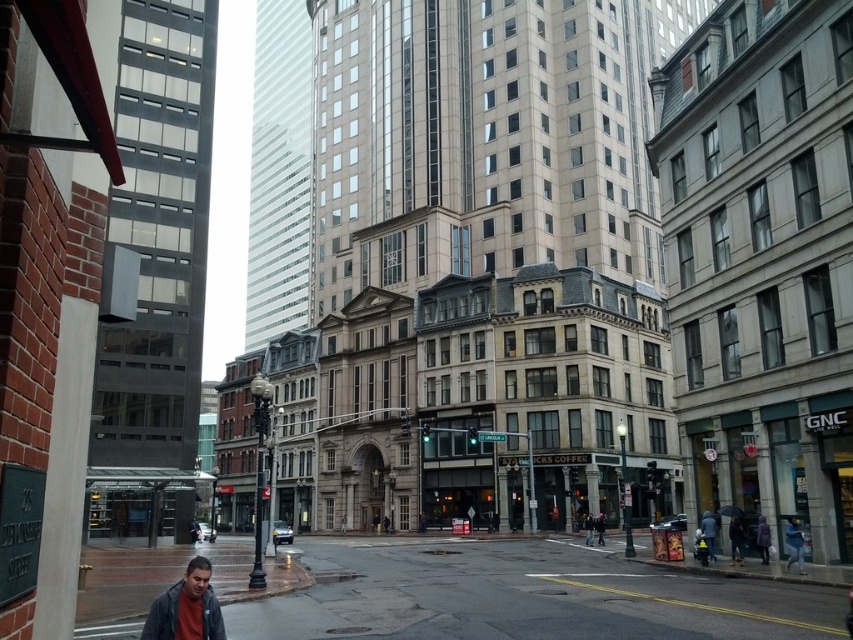
Question: Among these objects, which one is farthest from the camera?

Choices:
 (A) dark gray jacket at lower left
 (B) dark gray asphalt at lower center
 (C) dark blue jacket at lower right

Answer: (C)

Question: Is dark blue jacket at lower right to the right of purple matte coat at lower right from the viewer's perspective?

Choices:
 (A) no
 (B) yes

Answer: (A)

Question: Among these points, which one is nearest to the camera?

Choices:
 (A) (215, 596)
 (B) (305, 593)

Answer: (A)

Question: Is dark gray jacket at lower left closer to the viewer compared to purple matte coat at lower right?

Choices:
 (A) yes
 (B) no

Answer: (A)

Question: From the image, what is the correct spatial relationship of dark gray asphalt at lower center in relation to purple matte coat at lower right?

Choices:
 (A) right
 (B) left

Answer: (B)

Question: Which point is farther from the camera taking this photo?

Choices:
 (A) [x=759, y=538]
 (B) [x=738, y=552]
 (C) [x=544, y=572]

Answer: (C)